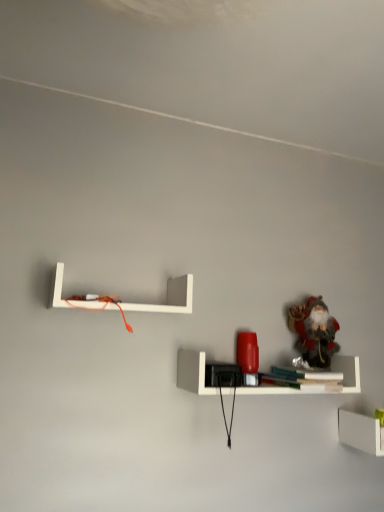
In order to click on white matte shelf at lower right, the 3th shelf from the left in this screenshot , I will do `click(359, 432)`.

Measure the distance between point (194, 367) and camera.

Point (194, 367) is 4.21 feet from camera.

Locate an element on the screen. The height and width of the screenshot is (512, 384). white matte line at upper center is located at coordinates (192, 121).

From the image's perspective, is frosted glass santa at upper right located beneath white matte line at upper center?

Correct, frosted glass santa at upper right appears lower than white matte line at upper center in the image.

How distant is frosted glass santa at upper right from white matte line at upper center?

They are 30.39 inches apart.

Looking at this image, from a real-world perspective, is frosted glass santa at upper right physically below white matte line at upper center?

Yes, from a real-world perspective, frosted glass santa at upper right is below white matte line at upper center.

Is the surface of frosted glass santa at upper right in direct contact with white matte shelf at lower right, which is the third shelf from top to bottom?

No, frosted glass santa at upper right is not next to white matte shelf at lower right, which is the third shelf from top to bottom.

Does frosted glass santa at upper right contain white matte shelf at lower right, which is the third shelf from top to bottom?

Actually, white matte shelf at lower right, which is the third shelf from top to bottom, is outside frosted glass santa at upper right.

From a real-world perspective, is frosted glass santa at upper right positioned above or below white matte shelf at lower right, marked as the first shelf in a bottom-to-top arrangement?

frosted glass santa at upper right is situated higher than white matte shelf at lower right, marked as the first shelf in a bottom-to-top arrangement, in the real world.

At what (x,y) coordinates should I click in order to perform the action: click on toy above the white matte shelf at lower right, marked as the first shelf in a bottom-to-top arrangement (from the image's perspective). Please return your answer as a coordinate pair (x, y). The width and height of the screenshot is (384, 512). Looking at the image, I should click on (314, 331).

Visually, is white matte shelf at lower right, the 3th shelf from the left, positioned to the left or to the right of white matte shelf at upper left, placed as the 3th shelf when sorted from right to left?

From the image, it's evident that white matte shelf at lower right, the 3th shelf from the left, is to the right of white matte shelf at upper left, placed as the 3th shelf when sorted from right to left.

From a real-world perspective, who is located higher, white matte shelf at lower right, which is the third shelf from top to bottom, or white matte shelf at upper left, placed as the 3th shelf when sorted from right to left?

From a 3D spatial view, white matte shelf at upper left, placed as the 3th shelf when sorted from right to left, is above.

Considering the positions of objects white matte shelf at lower right, marked as the first shelf in a bottom-to-top arrangement, and white matte shelf at upper left, which appears as the first shelf when viewed from the top, in the image provided, who is behind, white matte shelf at lower right, marked as the first shelf in a bottom-to-top arrangement, or white matte shelf at upper left, which appears as the first shelf when viewed from the top,?

white matte shelf at lower right, marked as the first shelf in a bottom-to-top arrangement, is further away from the camera.

Looking at this image, what's the angular difference between white matte shelf at lower right, which is the third shelf from top to bottom, and white matte shelf at upper left, which appears as the first shelf when viewed from the top,'s facing directions?

0.16 degrees separate the facing orientations of white matte shelf at lower right, which is the third shelf from top to bottom, and white matte shelf at upper left, which appears as the first shelf when viewed from the top.

Which object is further away from the camera, frosted glass santa at upper right or matte red lamp at center, the 2th shelf in the bottom-to-top sequence?

frosted glass santa at upper right is further away from the camera.

Is matte red lamp at center, acting as the 2th shelf starting from the top, inside frosted glass santa at upper right?

Definitely not — matte red lamp at center, acting as the 2th shelf starting from the top, is not inside frosted glass santa at upper right.

From the image's perspective, is frosted glass santa at upper right above or below matte red lamp at center, the 2th shelf when ordered from left to right?

Clearly, from the image's perspective, frosted glass santa at upper right is above matte red lamp at center, the 2th shelf when ordered from left to right.

Considering the relative sizes of white matte shelf at lower right, which is the third shelf from top to bottom, and frosted glass santa at upper right in the image provided, is white matte shelf at lower right, which is the third shelf from top to bottom, wider than frosted glass santa at upper right?

Yes, white matte shelf at lower right, which is the third shelf from top to bottom, is wider than frosted glass santa at upper right.

Is white matte shelf at lower right, marked as the first shelf in a bottom-to-top arrangement, not within frosted glass santa at upper right?

white matte shelf at lower right, marked as the first shelf in a bottom-to-top arrangement, is positioned outside frosted glass santa at upper right.

Is point (378, 453) farther from viewer compared to point (316, 298)?

No, (378, 453) is closer to viewer.

Considering the positions of objects white matte shelf at upper left, which appears as the first shelf when viewed from the top, and white matte shelf at lower right, marked as the first shelf in a bottom-to-top arrangement, in the image provided, who is more to the right, white matte shelf at upper left, which appears as the first shelf when viewed from the top, or white matte shelf at lower right, marked as the first shelf in a bottom-to-top arrangement,?

From the viewer's perspective, white matte shelf at lower right, marked as the first shelf in a bottom-to-top arrangement, appears more on the right side.

How many degrees apart are the facing directions of white matte shelf at upper left, placed as the 3th shelf when sorted from right to left, and white matte shelf at lower right, which is the third shelf from top to bottom?

The facing directions of white matte shelf at upper left, placed as the 3th shelf when sorted from right to left, and white matte shelf at lower right, which is the third shelf from top to bottom, are 0.16 degrees apart.

I want to click on the 2nd shelf counting from the right side of the white matte shelf at upper left, which appears as the first shelf when viewed from the top, so click(359, 432).

Is white matte shelf at lower right, the 3th shelf from the left, at the back of white matte shelf at upper left, marked as the first shelf in a left-to-right arrangement?

No, white matte shelf at upper left, marked as the first shelf in a left-to-right arrangement,'s orientation is not away from white matte shelf at lower right, the 3th shelf from the left.

Is white matte shelf at upper left, marked as the 3th shelf in a bottom-to-top arrangement, shorter than matte red lamp at center, which ranks as the second shelf in right-to-left order?

No, white matte shelf at upper left, marked as the 3th shelf in a bottom-to-top arrangement, is not shorter than matte red lamp at center, which ranks as the second shelf in right-to-left order.

In the scene shown: Between white matte shelf at upper left, marked as the first shelf in a left-to-right arrangement, and matte red lamp at center, the 2th shelf when ordered from left to right, which one appears on the left side from the viewer's perspective?

white matte shelf at upper left, marked as the first shelf in a left-to-right arrangement, is more to the left.

Looking at this image, in terms of width, does white matte shelf at upper left, marked as the 3th shelf in a bottom-to-top arrangement, look wider or thinner when compared to matte red lamp at center, acting as the 2th shelf starting from the top?

Considering their sizes, white matte shelf at upper left, marked as the 3th shelf in a bottom-to-top arrangement, looks slimmer than matte red lamp at center, acting as the 2th shelf starting from the top.

The image size is (384, 512). What are the coordinates of `line in front of the frosted glass santa at upper right` in the screenshot? It's located at click(x=192, y=121).

Find the location of a particular element. This screenshot has width=384, height=512. toy above the white matte shelf at lower right, which is the third shelf from top to bottom (from the image's perspective) is located at coordinates (314, 331).

Considering their positions, is frosted glass santa at upper right positioned further to matte red lamp at center, the 2th shelf in the bottom-to-top sequence, than white matte line at upper center?

Based on the image, white matte line at upper center appears to be further to matte red lamp at center, the 2th shelf in the bottom-to-top sequence.

Based on their spatial positions, is matte red lamp at center, which ranks as the second shelf in right-to-left order, or white matte line at upper center further from white matte shelf at lower right, which is the third shelf from top to bottom?

white matte line at upper center is further to white matte shelf at lower right, which is the third shelf from top to bottom.

When comparing their distances from white matte line at upper center, does frosted glass santa at upper right or white matte shelf at upper left, placed as the 3th shelf when sorted from right to left, seem closer?

white matte shelf at upper left, placed as the 3th shelf when sorted from right to left, lies closer to white matte line at upper center than the other object.

Considering their positions, is white matte shelf at lower right, the 3th shelf from the left, positioned further to matte red lamp at center, which ranks as the second shelf in right-to-left order, than frosted glass santa at upper right?

white matte shelf at lower right, the 3th shelf from the left, is further to matte red lamp at center, which ranks as the second shelf in right-to-left order.

Which object lies nearer to the anchor point matte red lamp at center, acting as the 2th shelf starting from the top, white matte shelf at upper left, marked as the 3th shelf in a bottom-to-top arrangement, or frosted glass santa at upper right?

Based on the image, frosted glass santa at upper right appears to be nearer to matte red lamp at center, acting as the 2th shelf starting from the top.

Considering their positions, is white matte shelf at upper left, marked as the 3th shelf in a bottom-to-top arrangement, positioned closer to white matte shelf at lower right, the 3th shelf from the left, than matte red lamp at center, acting as the 2th shelf starting from the top?

matte red lamp at center, acting as the 2th shelf starting from the top.

From the image, which object appears to be nearer to white matte shelf at lower right, which is the third shelf from top to bottom, white matte line at upper center or white matte shelf at upper left, placed as the 3th shelf when sorted from right to left?

white matte shelf at upper left, placed as the 3th shelf when sorted from right to left, lies closer to white matte shelf at lower right, which is the third shelf from top to bottom, than the other object.

Looking at the image, which one is located closer to frosted glass santa at upper right, matte red lamp at center, the 2th shelf when ordered from left to right, or white matte shelf at lower right, the 3th shelf from the left?

Based on the image, matte red lamp at center, the 2th shelf when ordered from left to right, appears to be nearer to frosted glass santa at upper right.

You are a GUI agent. You are given a task and a screenshot of the screen. Output one action in this format:
    pyautogui.click(x=<x>, y=<y>)
    Task: Click on the shelf between white matte line at upper center and frosted glass santa at upper right from top to bottom
    
    Given the screenshot: What is the action you would take?
    pyautogui.click(x=169, y=298)

Where is `toy situated between matte red lamp at center, acting as the 2th shelf starting from the top, and white matte shelf at lower right, the 3th shelf from the left, from left to right`? The image size is (384, 512). toy situated between matte red lamp at center, acting as the 2th shelf starting from the top, and white matte shelf at lower right, the 3th shelf from the left, from left to right is located at coordinates (314, 331).

Locate an element on the screen. toy between white matte shelf at upper left, which appears as the first shelf when viewed from the top, and white matte shelf at lower right, which appears as the 1th shelf when viewed from the right is located at coordinates (314, 331).

Locate an element on the screen. toy between white matte line at upper center and white matte shelf at lower right, the 3th shelf from the left, from top to bottom is located at coordinates (314, 331).